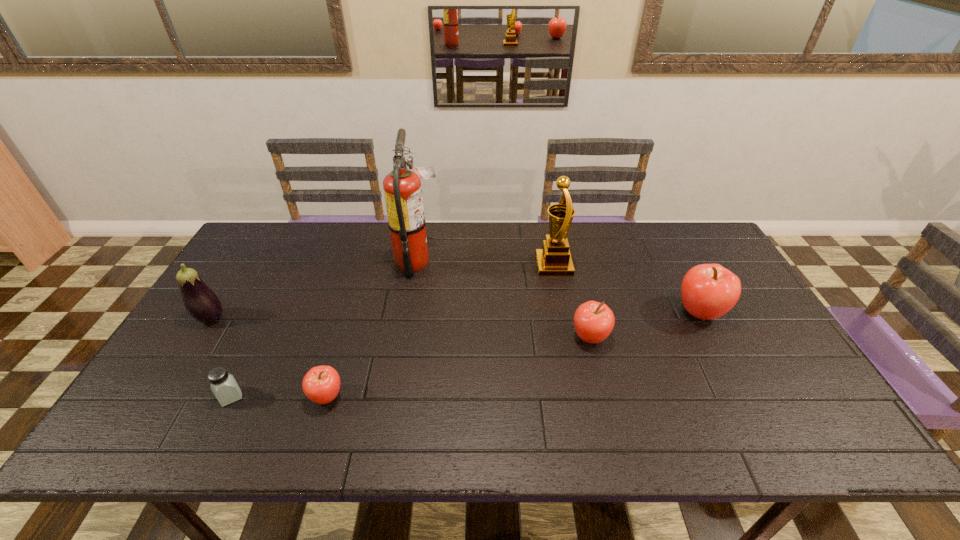
In order to click on fire extinguisher at the far edge in this screenshot , I will do `click(402, 188)`.

This screenshot has width=960, height=540. I want to click on award present at the far edge, so click(554, 259).

Find the location of a particular element. apple that is positioned at the near edge is located at coordinates (321, 384).

At what (x,y) coordinates should I click in order to perform the action: click on saltshaker situated at the near edge. Please return your answer as a coordinate pair (x, y). Image resolution: width=960 pixels, height=540 pixels. Looking at the image, I should click on (224, 386).

The image size is (960, 540). In order to click on object at the left edge in this screenshot , I will do `click(202, 304)`.

I want to click on object situated at the right edge, so (708, 291).

In the image, there is a desktop. Where is `free space at the far edge`? The width and height of the screenshot is (960, 540). free space at the far edge is located at coordinates (621, 223).

The image size is (960, 540). In order to click on free region at the near edge of the desktop in this screenshot , I will do `click(598, 405)`.

This screenshot has height=540, width=960. What are the coordinates of `free space at the left edge of the desktop` in the screenshot? It's located at (203, 353).

Image resolution: width=960 pixels, height=540 pixels. I want to click on free region at the right edge, so click(773, 344).